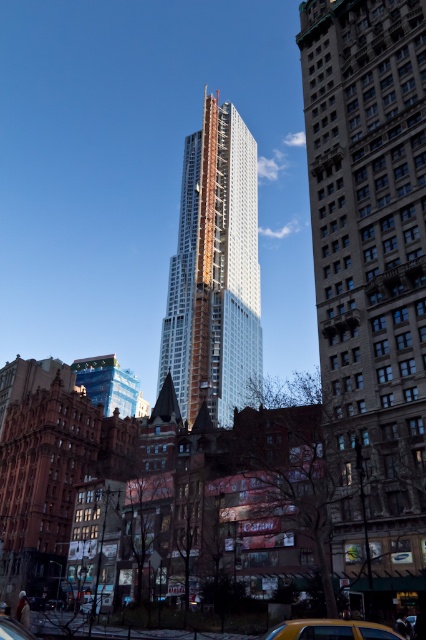
You are a city planner evaluating the urban layout. Considering the white glass skyscraper at center and the yellow rubber taxi at lower right, which object occupies a greater spatial footprint in the image?

The white glass skyscraper at center has a larger size compared to the yellow rubber taxi at lower right, so it occupies a greater spatial footprint in the image.

You are a city planner assessing the urban layout. Given the white glass skyscraper at center and the yellow rubber taxi at lower right, which object occupies a greater horizontal space in the image?

The white glass skyscraper at center occupies a greater horizontal space than the yellow rubber taxi at lower right because its width is larger according to the description.

You are a delivery driver needing to park your yellow rubber taxi at lower right near the white glass skyscraper at center. Based on the scene, can you park directly in front of the skyscraper?

The white glass skyscraper at center is positioned on the left side of the yellow rubber taxi at lower right, so parking directly in front of the skyscraper would require moving the taxi to the left side of its current position.